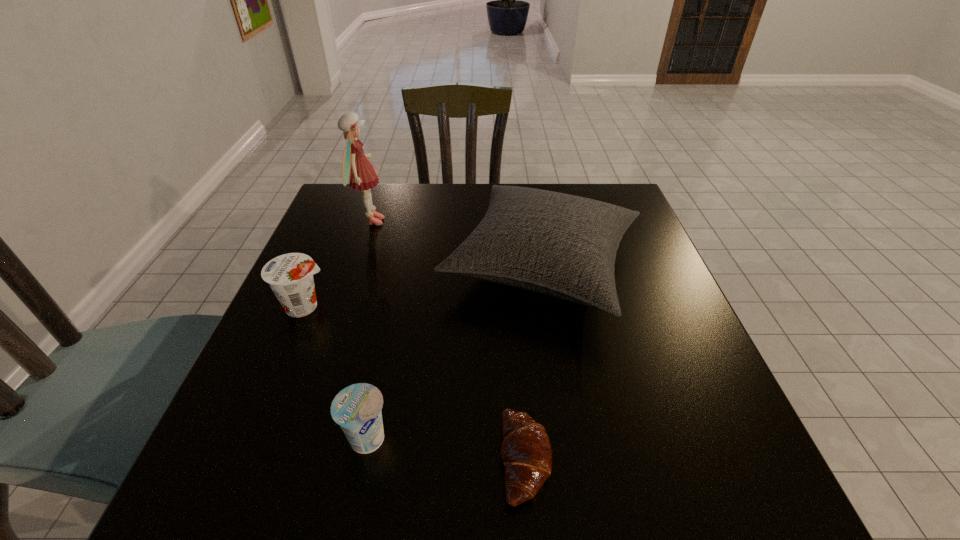
The width and height of the screenshot is (960, 540). Find the location of `doll`. doll is located at coordinates (356, 167).

Locate an element on the screen. The image size is (960, 540). cushion is located at coordinates (561, 245).

The height and width of the screenshot is (540, 960). Identify the location of the farther yogurt. (290, 276).

Find the location of a particular element. the nearer yogurt is located at coordinates pos(357,408).

The height and width of the screenshot is (540, 960). In order to click on the third object from right to left in this screenshot , I will do `click(357, 408)`.

This screenshot has width=960, height=540. Find the location of `crescent roll`. crescent roll is located at coordinates (526, 453).

Locate an element on the screen. The width and height of the screenshot is (960, 540). free space located 0.250m on the front-facing side of the tallest object is located at coordinates (480, 221).

At what (x,y) coordinates should I click in order to perform the action: click on vacant point located on the left of the cushion. Please return your answer as a coordinate pair (x, y). Looking at the image, I should click on (309, 266).

In order to click on free region located 0.100m on the right of the farther yogurt in this screenshot , I will do pos(379,306).

You are a GUI agent. You are given a task and a screenshot of the screen. Output one action in this format:
    pyautogui.click(x=<x>, y=<y>)
    Task: Click on the vacant space located 0.070m on the left of the third object from left to right
    The width and height of the screenshot is (960, 540).
    Given the screenshot: What is the action you would take?
    pyautogui.click(x=300, y=442)